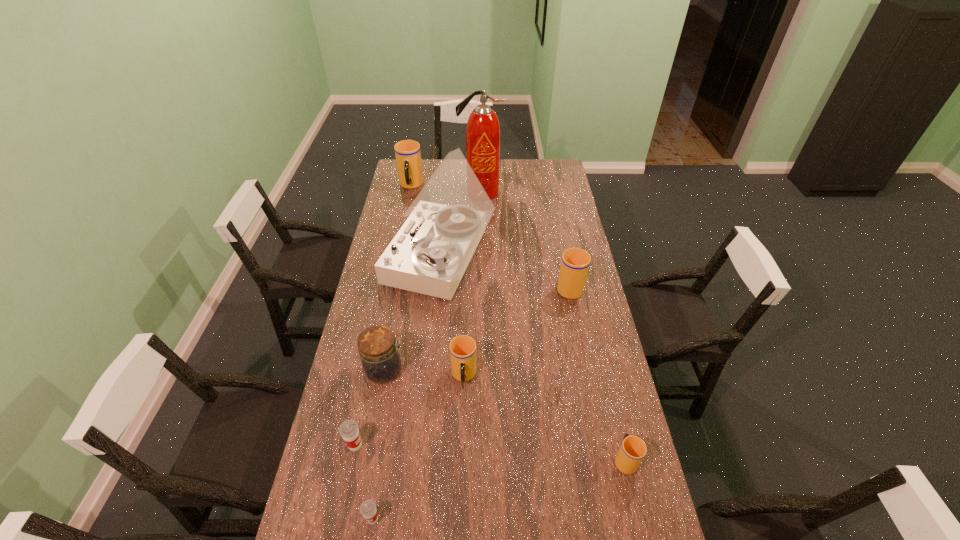
The image size is (960, 540). I want to click on free space that is in between the eighth shortest object and the jar, so click(x=413, y=314).

Locate an element on the screen. This screenshot has height=540, width=960. the sixth closest object relative to the smallest beige cup is located at coordinates (349, 430).

Select which object is the closest to the smallest beige cup. Please provide its 2D coordinates. Your answer should be formatted as a tuple, i.e. [(x, y)], where the tuple contains the x and y coordinates of a point satisfying the conditions above.

[(462, 348)]

At what (x,y) coordinates should I click in order to perform the action: click on the closest cup to the farthest cup. Please return your answer as a coordinate pair (x, y). The width and height of the screenshot is (960, 540). Looking at the image, I should click on (575, 262).

Identify which cup is the fourth closest to the smaller red cup. Please provide its 2D coordinates. Your answer should be formatted as a tuple, i.e. [(x, y)], where the tuple contains the x and y coordinates of a point satisfying the conditions above.

[(575, 262)]

Select which beige cup appears as the second closest to the seventh shortest object. Please provide its 2D coordinates. Your answer should be formatted as a tuple, i.e. [(x, y)], where the tuple contains the x and y coordinates of a point satisfying the conditions above.

[(462, 348)]

The width and height of the screenshot is (960, 540). What are the coordinates of `the fourth closest beige cup to the jar` in the screenshot? It's located at (407, 152).

At what (x,y) coordinates should I click in order to perform the action: click on free space that satisfies the following two spatial constraints: 1. on the side of the tallest object with the handle; 2. on the left side of the leftmost beige cup. Please return your answer as a coordinate pair (x, y). This screenshot has height=540, width=960. Looking at the image, I should click on (410, 192).